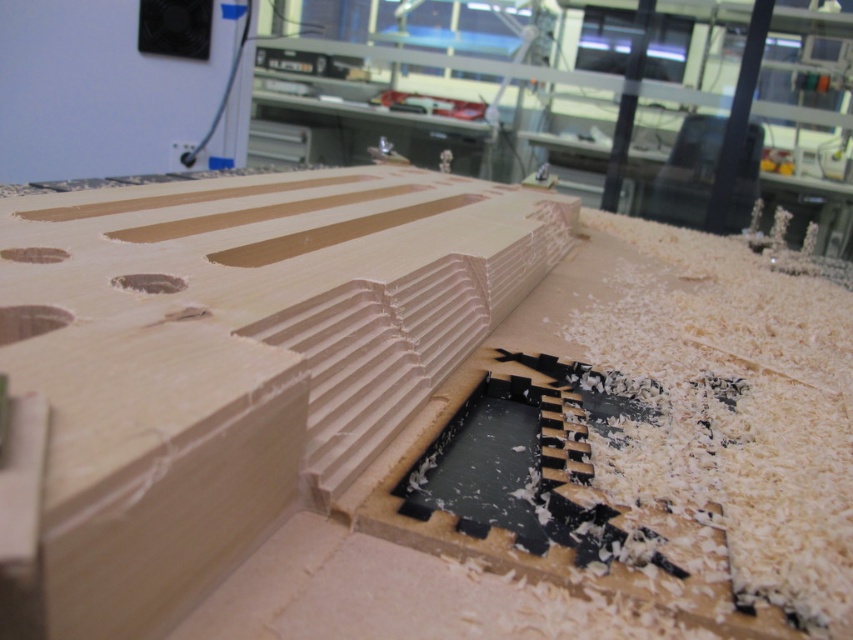
Between natural wood plywood at center and natural wood plank at center, which one has less height?

natural wood plank at center

Find the location of a particular element. The width and height of the screenshot is (853, 640). natural wood plywood at center is located at coordinates (242, 358).

Which is above, natural wood plywood at center or light brown wood hole at center?

Positioned higher is natural wood plywood at center.

Between point (358, 244) and point (16, 308), which one is positioned in front?

Point (16, 308) is more forward.

Locate an element on the screen. The height and width of the screenshot is (640, 853). natural wood plywood at center is located at coordinates (242, 358).

In order to click on light brown wood hole at center in this screenshot , I will do tap(28, 321).

How far apart are light brown wood hole at center and matte brown wood at center?

The distance of light brown wood hole at center from matte brown wood at center is 8.63 centimeters.

Is point (30, 332) positioned in front of point (164, 275)?

Yes, point (30, 332) is closer to viewer.

This screenshot has width=853, height=640. I want to click on light brown wood hole at center, so click(x=28, y=321).